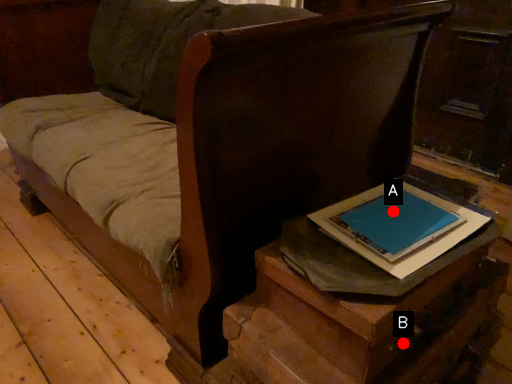
Question: Two points are circled on the image, labeled by A and B beside each circle. Which of the following is the closest to the observer?

Choices:
 (A) A is closer
 (B) B is closer

Answer: (B)